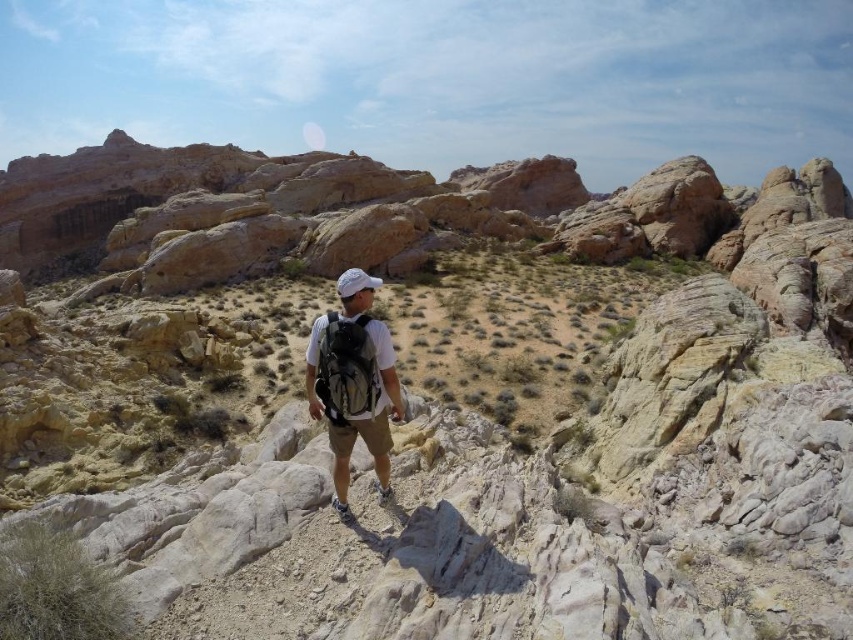
You are a hiker trying to reach the summit. You have a white matte backpack at center and a matte gray backpack at center. Which backpack should you grab first if you want to pick up the one closer to you?

The white matte backpack at center is closer to you than the matte gray backpack at center, so you should grab the white matte backpack at center first.

You are a hiker looking at the two backpacks in the scene. Which backpack is closer to you, the white matte backpack at center or the matte gray backpack at center?

The white matte backpack at center is closer to you because it is further to the viewer than the matte gray backpack at center.

You are a hiker trying to decide which backpack to choose for your next trip. You notice the white matte backpack at center and the matte gray backpack at center. Based on their sizes, which one has more vertical space for packing items?

The white matte backpack at center is taller than the matte gray backpack at center, so it has more vertical space for packing items.